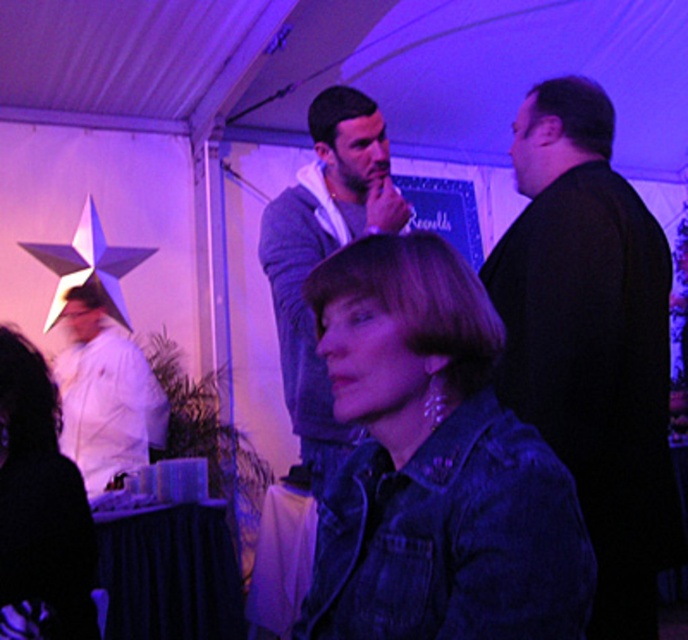
Does denim jacket at lower right appear on the right side of matte white shirt at left?

Correct, you'll find denim jacket at lower right to the right of matte white shirt at left.

Who is more distant from viewer, (380, 486) or (1, 554)?

Positioned behind is point (1, 554).

Identify the location of denim jacket at lower right. The image size is (688, 640). (433, 465).

Does point (312, 371) come closer to viewer compared to point (47, 410)?

No.

At what (x,y) coordinates should I click in order to perform the action: click on knitted sweater at center. Please return your answer as a coordinate pair (x, y). The height and width of the screenshot is (640, 688). Looking at the image, I should click on (323, 257).

Who is higher up, matte white shirt at left or white matte chef coat at left?

matte white shirt at left

Is point (52, 403) positioned after point (74, 442)?

That is False.

The height and width of the screenshot is (640, 688). I want to click on matte white shirt at left, so click(x=41, y=499).